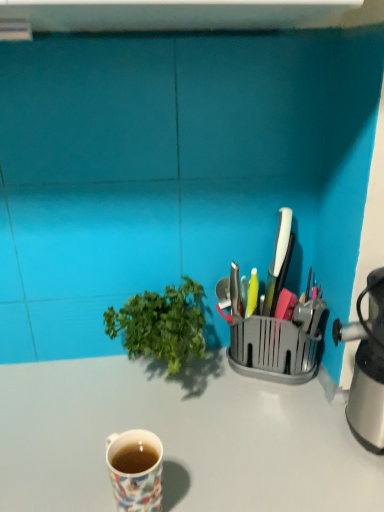
You are a GUI agent. You are given a task and a screenshot of the screen. Output one action in this format:
    pyautogui.click(x=<x>, y=<y>)
    Task: Click on the vacant region to the right of green leafy plant at center
    The image size is (384, 512).
    Given the screenshot: What is the action you would take?
    pyautogui.click(x=251, y=405)